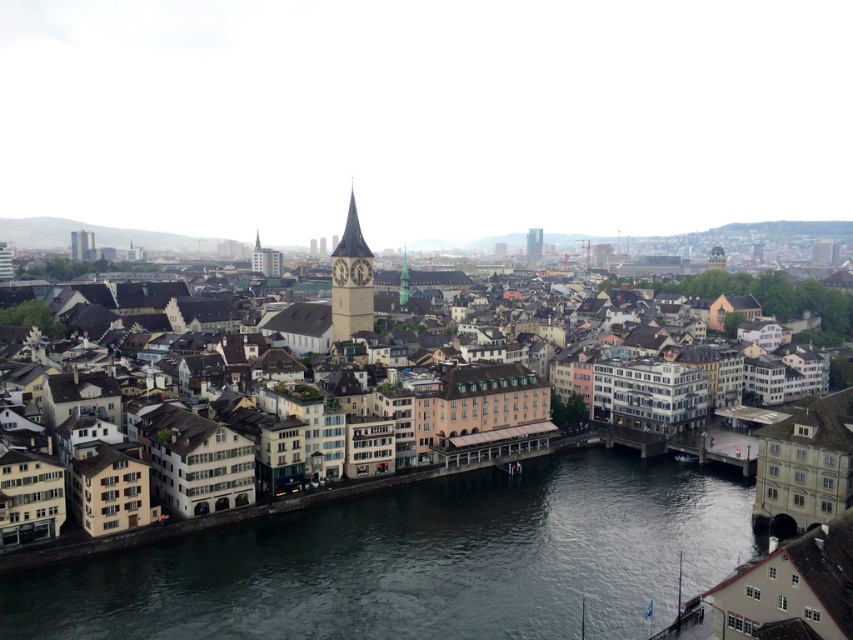
Question: Which point is closer to the camera?

Choices:
 (A) (718, 465)
 (B) (405, 300)
 (C) (426, 586)
 (D) (538, 236)

Answer: (C)

Question: Does smooth stone tower at center appear on the right side of glassy modern skyscraper at center?

Choices:
 (A) yes
 (B) no

Answer: (B)

Question: Estimate the real-world distances between objects in this image. Which object is farther from the smooth stone tower at center?

Choices:
 (A) glassy modern skyscraper at center
 (B) white stone buildings at center

Answer: (A)

Question: Is dark gray water at center wider than smooth stone tower at center?

Choices:
 (A) no
 (B) yes

Answer: (B)

Question: Can you confirm if white stone buildings at center is bigger than green glass spire at center?

Choices:
 (A) no
 (B) yes

Answer: (B)

Question: Which object is the closest to the green glass spire at center?

Choices:
 (A) smooth stone tower at center
 (B) glassy modern skyscraper at center

Answer: (A)